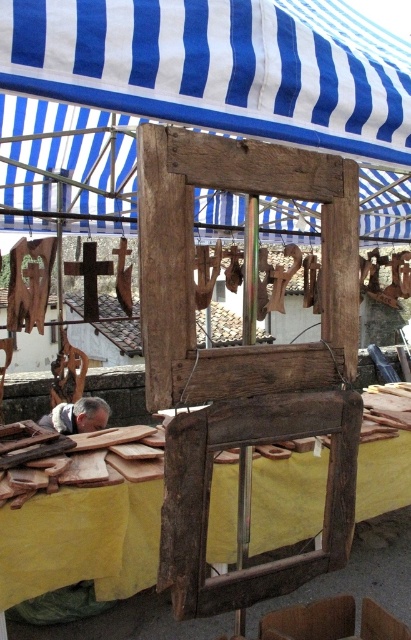
In the scene shown: You are standing in front of the rustic wooden structure. Can you tell me what object is located at the coordinate point (205, 90)?

The point (205, 90) corresponds to the blue striped fabric at upper center.